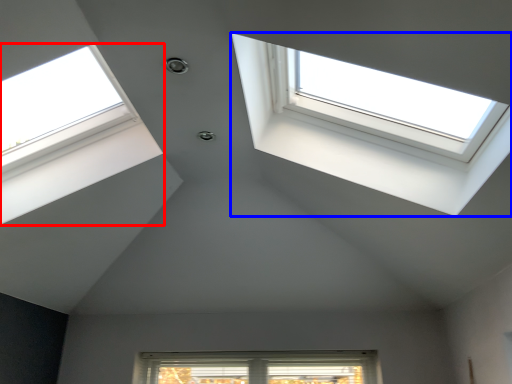
Question: Among these objects, which one is farthest to the camera, window (highlighted by a red box) or window (highlighted by a blue box)?

Choices:
 (A) window
 (B) window

Answer: (A)